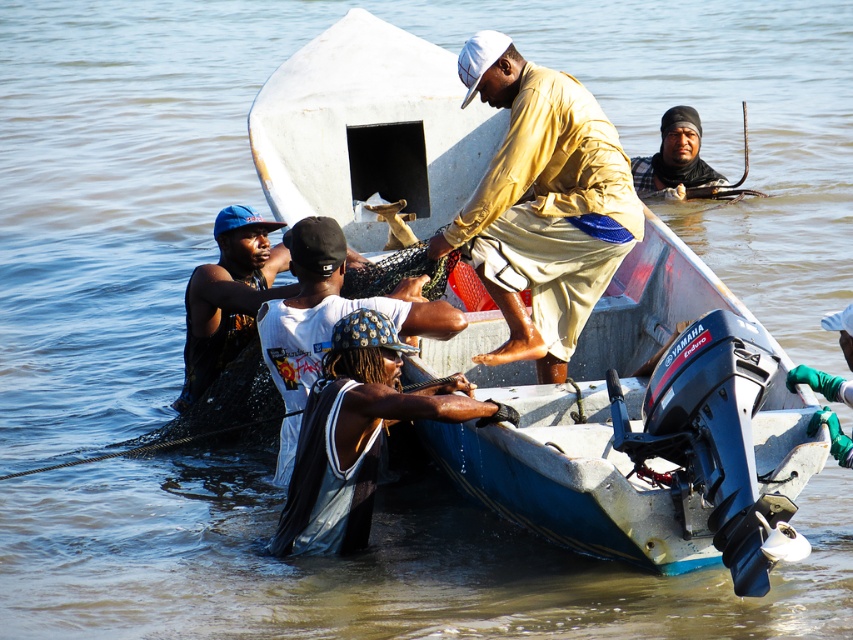
What do you see at coordinates (543, 204) in the screenshot? The width and height of the screenshot is (853, 640). I see `matte yellow shirt at center` at bounding box center [543, 204].

Can you confirm if matte yellow shirt at center is shorter than dark brown leather jacket at upper center?

No, matte yellow shirt at center is not shorter than dark brown leather jacket at upper center.

Does point (596, 291) lie behind point (694, 157)?

No, (596, 291) is in front of (694, 157).

You are a GUI agent. You are given a task and a screenshot of the screen. Output one action in this format:
    pyautogui.click(x=<x>, y=<y>)
    Task: Click on the matte yellow shirt at center
    
    Given the screenshot: What is the action you would take?
    pos(543,204)

Who is higher up, matte yellow shirt at center or white matte shirt at center?

Positioned higher is matte yellow shirt at center.

The width and height of the screenshot is (853, 640). I want to click on matte yellow shirt at center, so click(543, 204).

Does dark blue fabric at center appear on the left side of dark brown leather jacket at upper center?

Indeed, dark blue fabric at center is positioned on the left side of dark brown leather jacket at upper center.

I want to click on dark blue fabric at center, so click(x=358, y=433).